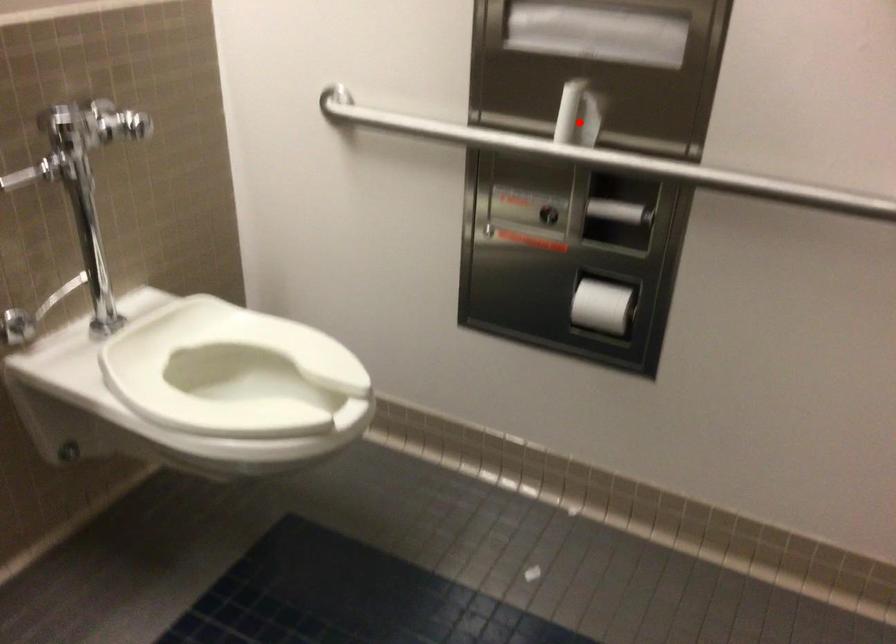
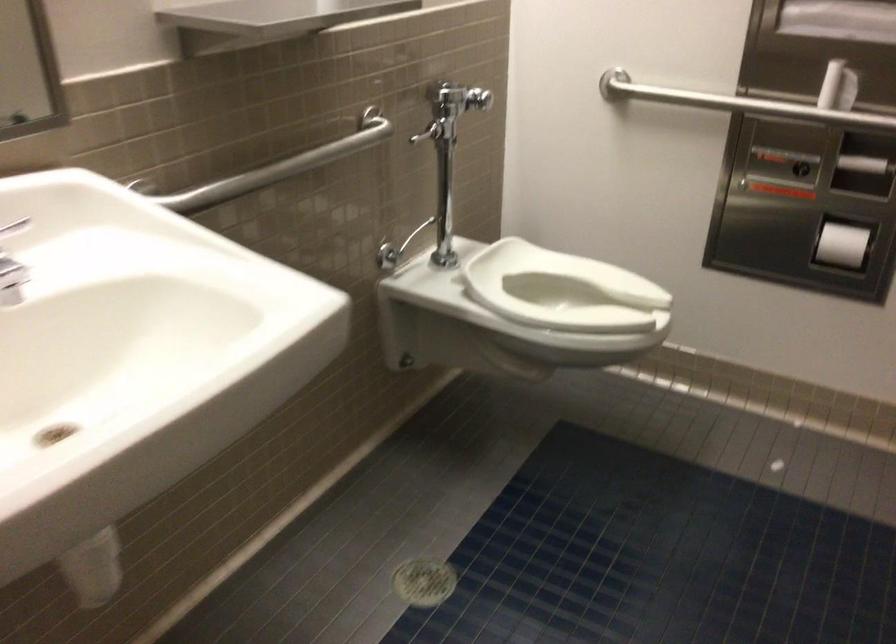
Locate, in the second image, the point that corresponds to the highlighted location in the first image.

(838, 87)